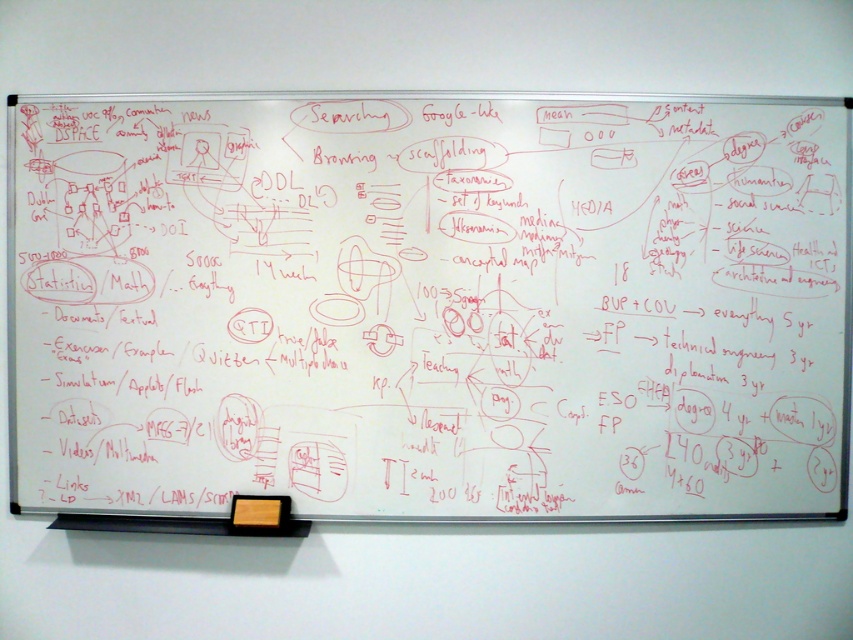
Who is higher up, whiteboard at upper center or orange matte sticky note at lower center?

whiteboard at upper center is higher up.

Does whiteboard at upper center have a larger size compared to orange matte sticky note at lower center?

Indeed, whiteboard at upper center has a larger size compared to orange matte sticky note at lower center.

Who is more forward, (x=715, y=408) or (x=251, y=518)?

Point (x=251, y=518) is in front.

Find the location of a particular element. The height and width of the screenshot is (640, 853). whiteboard at upper center is located at coordinates (430, 305).